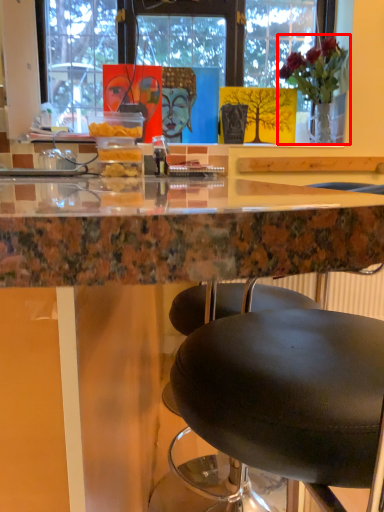
Question: From the image's perspective, considering the relative positions of houseplant (annotated by the red box) and table in the image provided, where is houseplant (annotated by the red box) located with respect to the staircase?

Choices:
 (A) above
 (B) below

Answer: (A)